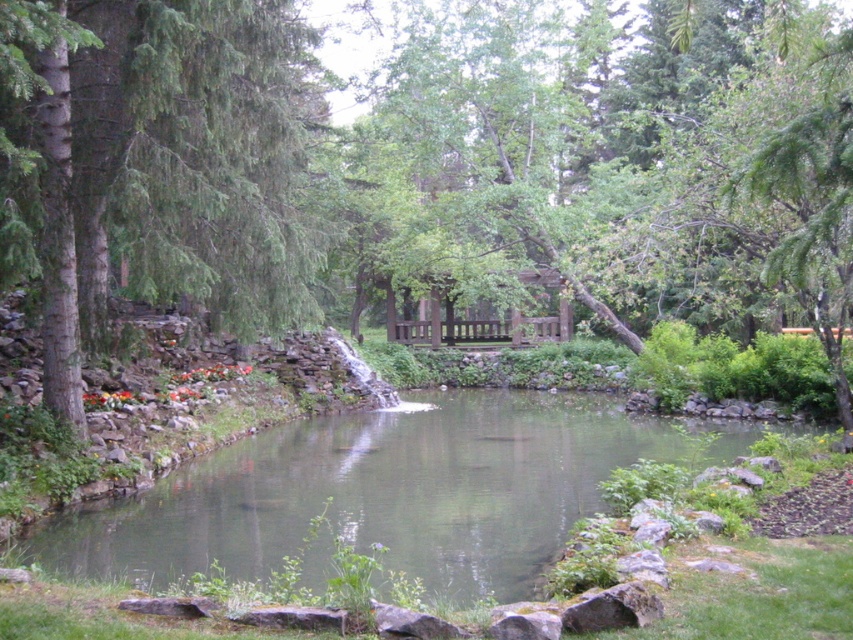
Question: Estimate the real-world distances between objects in this image. Which object is farther from the brown wooden gazebo at center?

Choices:
 (A) green evergreen tree at left
 (B) green stone lake at center

Answer: (A)

Question: Is green stone lake at center closer to the viewer compared to brown wooden gazebo at center?

Choices:
 (A) no
 (B) yes

Answer: (B)

Question: Is green leafy tree at center below brown wooden gazebo at center?

Choices:
 (A) yes
 (B) no

Answer: (B)

Question: Is green evergreen tree at left wider than green stone lake at center?

Choices:
 (A) yes
 (B) no

Answer: (B)

Question: Which of the following is the closest to the observer?

Choices:
 (A) (456, 321)
 (B) (254, 84)
 (C) (16, 205)
 (D) (459, 577)

Answer: (D)

Question: Among these objects, which one is nearest to the camera?

Choices:
 (A) brown wooden gazebo at center
 (B) green leafy tree at center

Answer: (B)